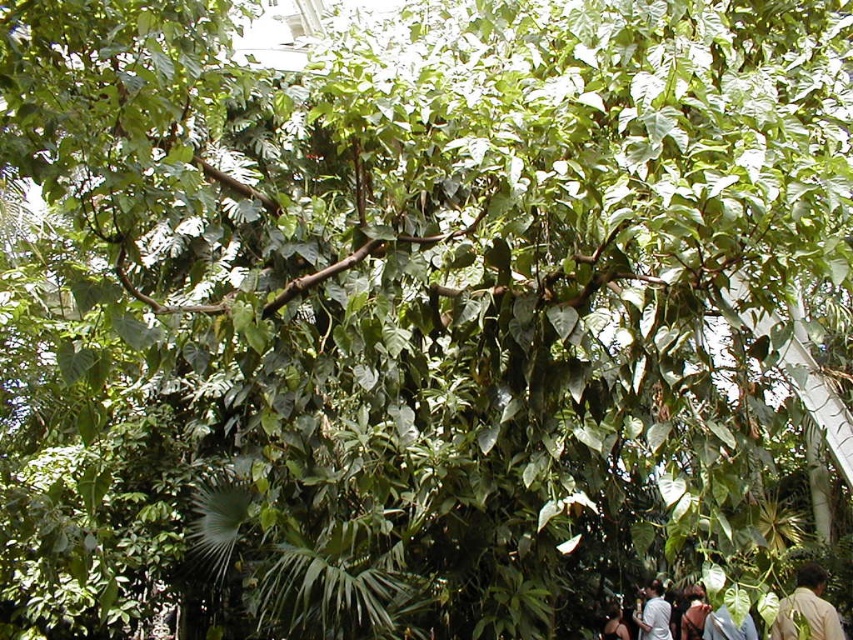
Can you confirm if light brown skin at lower right is positioned to the right of white shirt at lower right?

Indeed, light brown skin at lower right is positioned on the right side of white shirt at lower right.

What do you see at coordinates (807, 608) in the screenshot?
I see `light brown skin at lower right` at bounding box center [807, 608].

Who is more forward, (x=813, y=596) or (x=643, y=611)?

Point (x=813, y=596)

At what (x,y) coordinates should I click in order to perform the action: click on light brown skin at lower right. Please return your answer as a coordinate pair (x, y). Looking at the image, I should click on click(x=807, y=608).

Between point (645, 618) and point (699, 604), which one is positioned behind?

The point (699, 604) is behind.

Is point (663, 614) behind point (686, 608)?

No, (663, 614) is closer to viewer.

The image size is (853, 640). Find the location of `white shirt at lower right`. white shirt at lower right is located at coordinates (654, 612).

Who is shorter, white shirt at lower right or light brown leather jacket at lower center?

Standing shorter between the two is light brown leather jacket at lower center.

How much distance is there between white shirt at lower right and light brown leather jacket at lower center?

white shirt at lower right is 25.08 inches away from light brown leather jacket at lower center.

Is point (651, 624) positioned before point (606, 627)?

That is False.

Where is `white shirt at lower right`? white shirt at lower right is located at coordinates (654, 612).